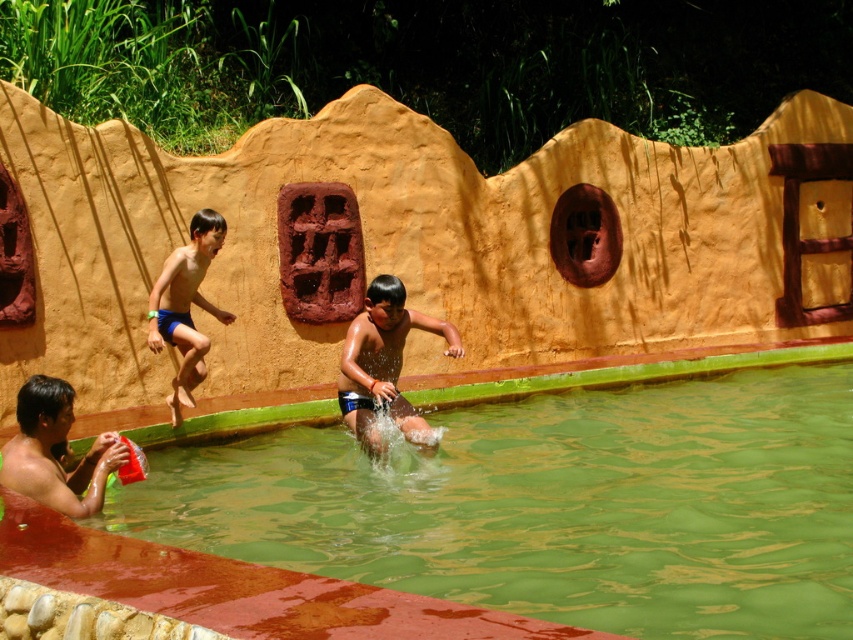
Question: Which of the following is the closest to the observer?

Choices:
 (A) (259, 422)
 (B) (345, 401)
 (C) (103, 458)

Answer: (C)

Question: Is green smooth water at center to the right of smooth brown shorts at center from the viewer's perspective?

Choices:
 (A) no
 (B) yes

Answer: (B)

Question: Which object is closer to the camera taking this photo?

Choices:
 (A) smooth skin man at lower left
 (B) blue shorts at left
 (C) smooth brown shorts at center

Answer: (A)

Question: Which point is farther to the camera?

Choices:
 (A) blue shorts at left
 (B) green smooth water at center
 (C) smooth brown shorts at center

Answer: (A)

Question: Considering the relative positions of green smooth water at center and smooth brown shorts at center in the image provided, where is green smooth water at center located with respect to smooth brown shorts at center?

Choices:
 (A) below
 (B) above

Answer: (A)

Question: Is the position of smooth brown shorts at center less distant than that of smooth skin man at lower left?

Choices:
 (A) no
 (B) yes

Answer: (A)